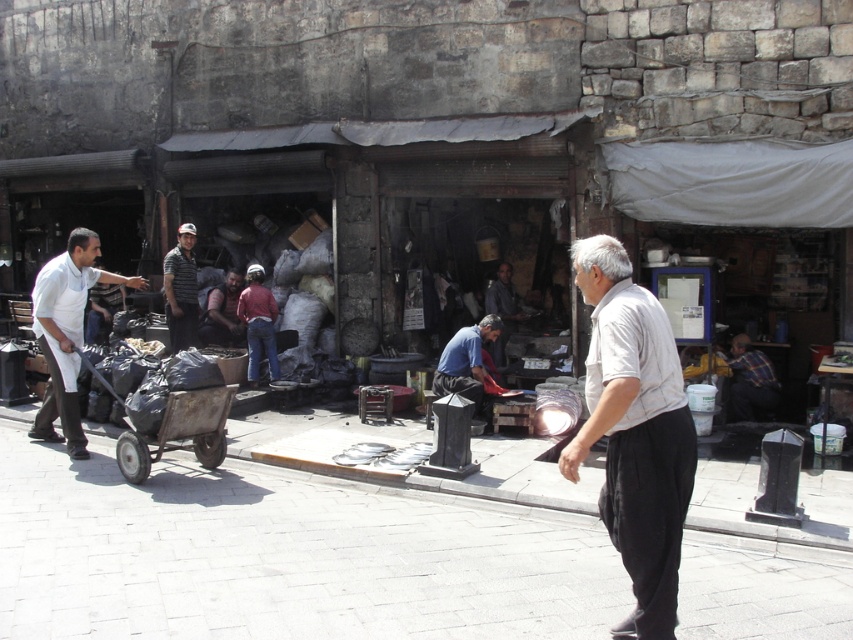
You are a photographer trying to capture a candid shot of the two men in the scene. The striped shirt at center and the dark gray fabric shirt at center are both in your viewfinder. Which man is positioned higher in the frame?

The striped shirt at center is above the dark gray fabric shirt at center, meaning the man wearing the striped shirt at center is positioned higher in the frame.

You are standing at the camera position and want to throw a small ball to hit the blue shirt at center without hitting the white cotton shirt at center. Given that the ball travels in a straight line, is it possible to do so?

The distance between the white cotton shirt at center and the blue shirt at center is 5.02 meters, so yes, it is possible to throw the ball in a straight line to hit the blue shirt at center while avoiding the white cotton shirt at center as they are separated by a significant distance.